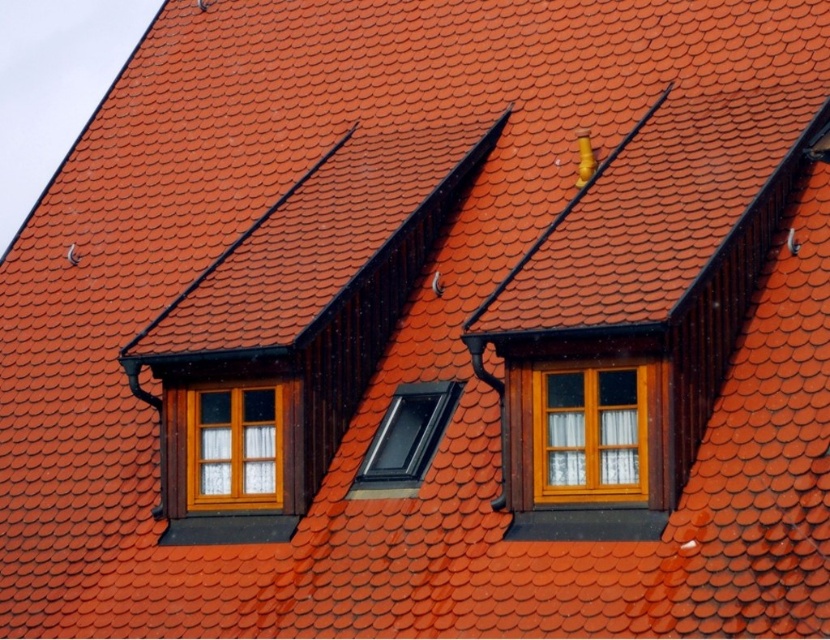
You are a contractor assessing the roof structure. You notice the wooden window at center and the transparent plastic skylight at center. Which object is closer to you when looking at the roof from below?

The wooden window at center is closer to you because the transparent plastic skylight at center is behind it.